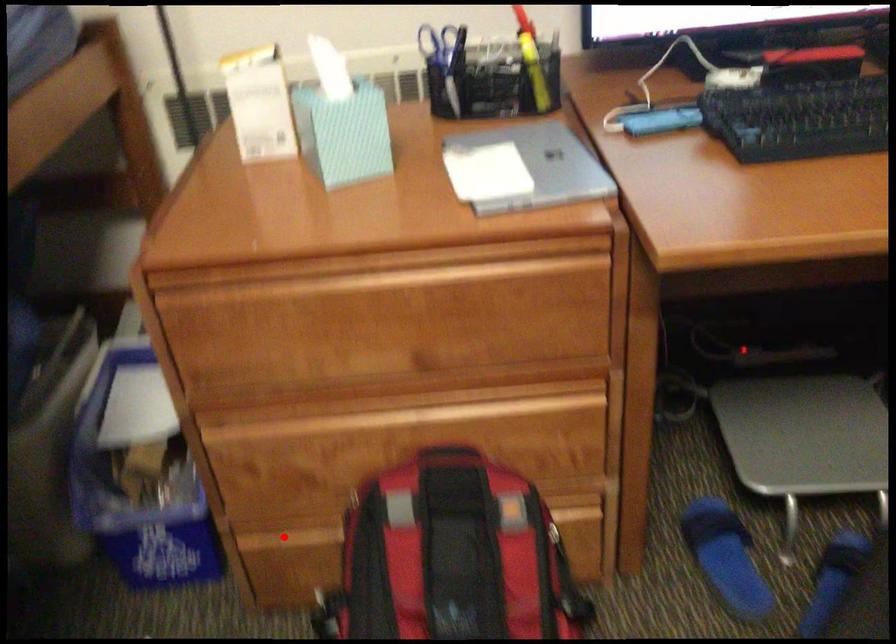
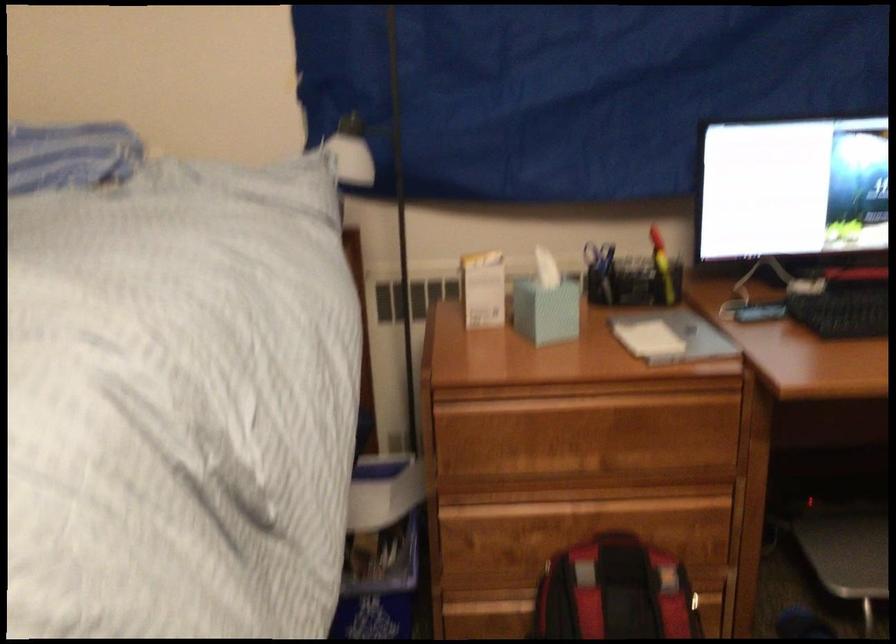
Question: A red point is marked in image1. In image2, is the corresponding 3D point closer to the camera or farther? Reply with the corresponding letter.

Choices:
 (A) The corresponding 3D point is closer.
 (B) The corresponding 3D point is farther.

Answer: (B)